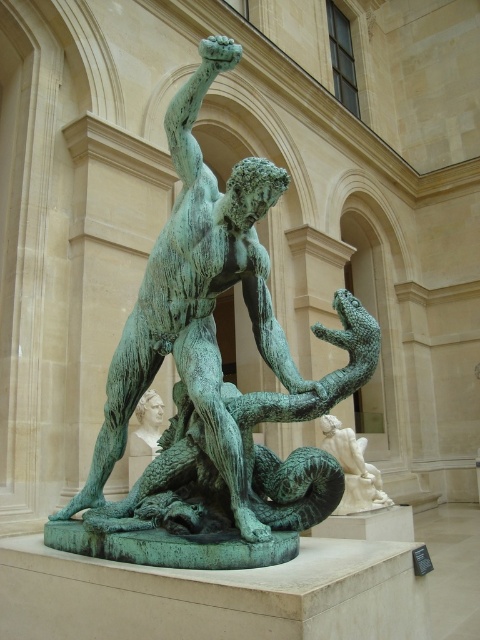
Question: Which point is farther to the camera?

Choices:
 (A) green patina bronze statue at center
 (B) white marble statue at center
 (C) smooth white marble bust at center

Answer: (C)

Question: Does green patina bronze statue at center have a larger size compared to smooth white marble bust at center?

Choices:
 (A) no
 (B) yes

Answer: (B)

Question: Can you confirm if green patina bronze statue at center is positioned above smooth white marble bust at center?

Choices:
 (A) no
 (B) yes

Answer: (B)

Question: From the image, what is the correct spatial relationship of white marble statue at center in relation to smooth white marble bust at center?

Choices:
 (A) right
 (B) left

Answer: (A)

Question: Among these points, which one is farthest from the camera?

Choices:
 (A) (218, 516)
 (B) (344, 493)

Answer: (B)

Question: Considering the real-world distances, which object is closest to the smooth white marble bust at center?

Choices:
 (A) white marble statue at center
 (B) green patina bronze statue at center

Answer: (B)